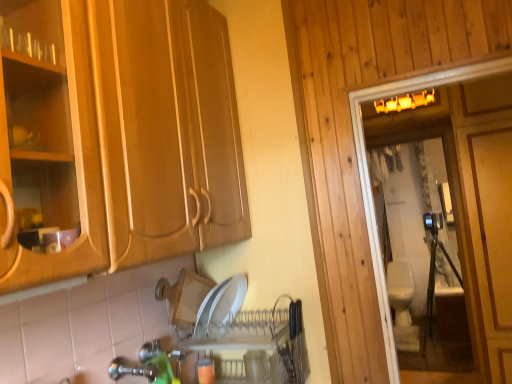
Question: Which is correct: beige ceramic toilet at right is inside white glossy toilet at right, or outside of it?

Choices:
 (A) outside
 (B) inside

Answer: (A)

Question: In the image, is beige ceramic toilet at right positioned in front of or behind white glossy toilet at right?

Choices:
 (A) front
 (B) behind

Answer: (B)

Question: Which object is positioned closest to the beige ceramic toilet at right?

Choices:
 (A) white glossy toilet at right
 (B) green plastic faucet at lower center

Answer: (A)

Question: Which object is the closest to the beige ceramic toilet at right?

Choices:
 (A) white glossy toilet at right
 (B) green plastic faucet at lower center

Answer: (A)